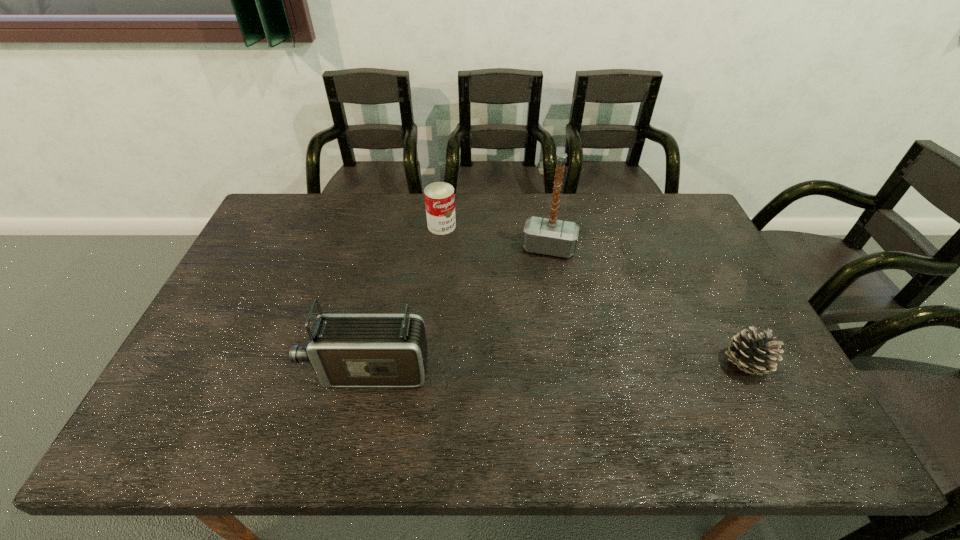
I want to click on free space between the third shortest object and the can, so click(405, 298).

What are the coordinates of `vacant point located between the rightmost object and the third tallest object` in the screenshot? It's located at (593, 295).

Find the location of a particular element. free space between the pinecone and the third object from left to right is located at coordinates (647, 306).

The image size is (960, 540). Find the location of `free space between the third nearest object and the third shortest object`. free space between the third nearest object and the third shortest object is located at coordinates (458, 309).

At what (x,y) coordinates should I click in order to perform the action: click on vacant space in between the third tallest object and the pinecone. Please return your answer as a coordinate pair (x, y). The width and height of the screenshot is (960, 540). Looking at the image, I should click on click(593, 295).

This screenshot has width=960, height=540. Identify the location of vacant space that is in between the farthest object and the tallest object. [495, 237].

Image resolution: width=960 pixels, height=540 pixels. In order to click on empty location between the second object from right to left and the shortest object in this screenshot , I will do click(647, 306).

Where is `free space between the second tallest object and the second farthest object`? free space between the second tallest object and the second farthest object is located at coordinates (458, 309).

At what (x,y) coordinates should I click in order to perform the action: click on vacant area between the third shortest object and the tallest object. Please return your answer as a coordinate pair (x, y). This screenshot has width=960, height=540. Looking at the image, I should click on (458, 309).

Where is `empty space that is in between the third tallest object and the camcorder`? This screenshot has height=540, width=960. empty space that is in between the third tallest object and the camcorder is located at coordinates (405, 298).